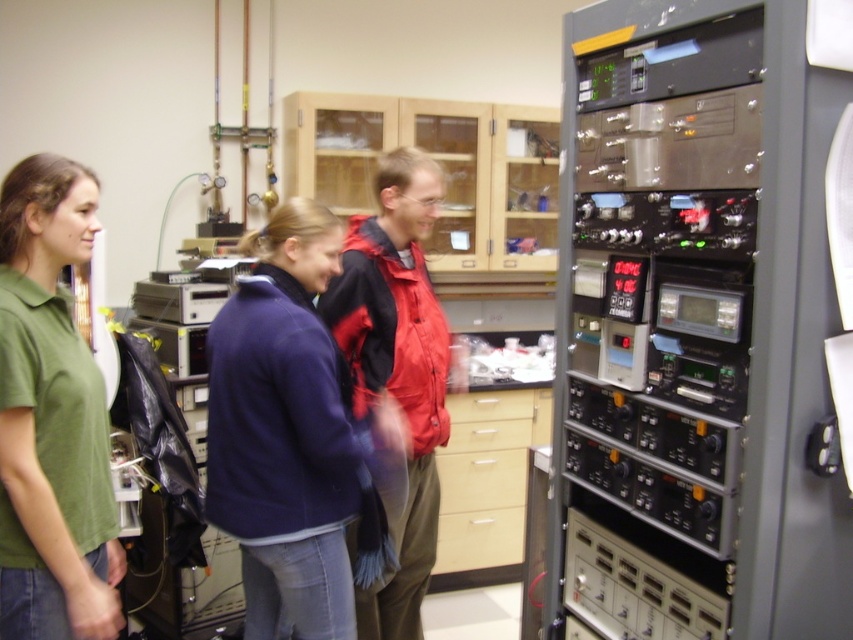
Question: Which point is farther to the camera?

Choices:
 (A) navy blue fabric coat at center
 (B) green cotton shirt at left

Answer: (A)

Question: Which point appears farthest from the camera in this image?

Choices:
 (A) (105, 524)
 (B) (308, 422)
 (C) (428, 161)

Answer: (C)

Question: Which point is closer to the camera taking this photo?

Choices:
 (A) (109, 605)
 (B) (320, 600)
 (C) (404, 509)

Answer: (A)

Question: Can you confirm if navy blue fabric coat at center is thinner than red matte jacket at center?

Choices:
 (A) no
 (B) yes

Answer: (A)

Question: Is the position of navy blue fabric coat at center less distant than that of red matte jacket at center?

Choices:
 (A) yes
 (B) no

Answer: (A)

Question: Is navy blue fabric coat at center in front of red matte jacket at center?

Choices:
 (A) no
 (B) yes

Answer: (B)